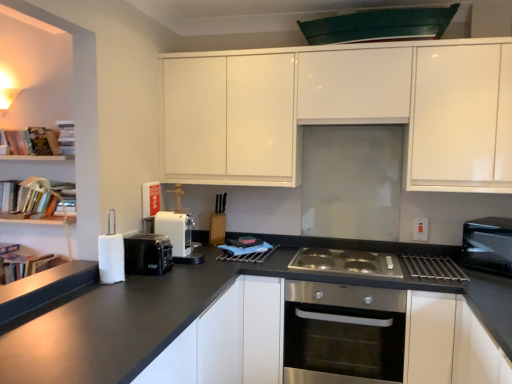
Question: Which direction should I rotate to look at glossy white cabinets at upper center, the 2th cabinetry ordered from the bottom, — up or down?

Choices:
 (A) up
 (B) down

Answer: (A)

Question: Can you confirm if glossy white cabinets at upper center, the 2th cabinetry ordered from the bottom, is taller than hardcover books at upper left, the 4th book from the left?

Choices:
 (A) yes
 (B) no

Answer: (A)

Question: Is hardcover books at upper left, the 4th book from the left, completely or partially inside glossy white cabinets at upper center, the 1th cabinetry positioned from the top?

Choices:
 (A) yes
 (B) no

Answer: (B)

Question: Considering the relative sizes of glossy white cabinets at upper center, the 1th cabinetry positioned from the top, and hardcover books at upper left, which ranks as the 1th book in right-to-left order, in the image provided, is glossy white cabinets at upper center, the 1th cabinetry positioned from the top, bigger than hardcover books at upper left, which ranks as the 1th book in right-to-left order,?

Choices:
 (A) yes
 (B) no

Answer: (A)

Question: Considering the relative positions of glossy white cabinets at upper center, the 1th cabinetry positioned from the top, and hardcover books at upper left, which ranks as the 1th book in right-to-left order, in the image provided, is glossy white cabinets at upper center, the 1th cabinetry positioned from the top, behind hardcover books at upper left, which ranks as the 1th book in right-to-left order,?

Choices:
 (A) yes
 (B) no

Answer: (B)

Question: Is glossy white cabinets at upper center, the 2th cabinetry ordered from the bottom, oriented towards hardcover books at upper left, which ranks as the 1th book in right-to-left order?

Choices:
 (A) no
 (B) yes

Answer: (A)

Question: Is glossy white cabinets at upper center, the 2th cabinetry ordered from the bottom, in contact with hardcover books at upper left, which ranks as the 1th book in right-to-left order?

Choices:
 (A) yes
 (B) no

Answer: (B)

Question: Considering the relative sizes of hardcover book at left, positioned as the 3th book in right-to-left order, and white plastic coffee machine at center, marked as the second appliance in a front-to-back arrangement, in the image provided, is hardcover book at left, positioned as the 3th book in right-to-left order, shorter than white plastic coffee machine at center, marked as the second appliance in a front-to-back arrangement,?

Choices:
 (A) yes
 (B) no

Answer: (B)

Question: From the image's perspective, is hardcover book at left, positioned as the second book in left-to-right order, below white plastic coffee machine at center, positioned as the 1th appliance in back-to-front order?

Choices:
 (A) no
 (B) yes

Answer: (A)

Question: Is hardcover book at left, positioned as the second book in left-to-right order, to the left of white plastic coffee machine at center, marked as the second appliance in a front-to-back arrangement, from the viewer's perspective?

Choices:
 (A) yes
 (B) no

Answer: (A)

Question: Is hardcover book at left, positioned as the second book in left-to-right order, closer to camera compared to white plastic coffee machine at center, marked as the second appliance in a front-to-back arrangement?

Choices:
 (A) yes
 (B) no

Answer: (B)

Question: Is hardcover book at left, positioned as the second book in left-to-right order, taller than white plastic coffee machine at center, positioned as the 1th appliance in back-to-front order?

Choices:
 (A) no
 (B) yes

Answer: (B)

Question: Can you confirm if hardcover book at left, positioned as the second book in left-to-right order, is positioned to the right of white plastic coffee machine at center, positioned as the 1th appliance in back-to-front order?

Choices:
 (A) no
 (B) yes

Answer: (A)

Question: Is the surface of white plastic coffee machine at center, positioned as the 1th appliance in back-to-front order, in direct contact with white plastic electric outlet at right?

Choices:
 (A) no
 (B) yes

Answer: (A)